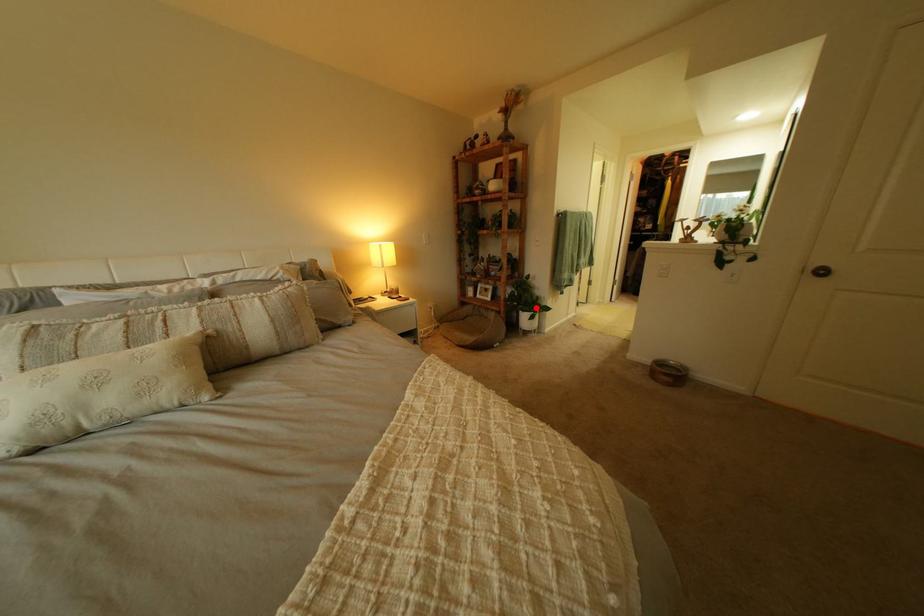
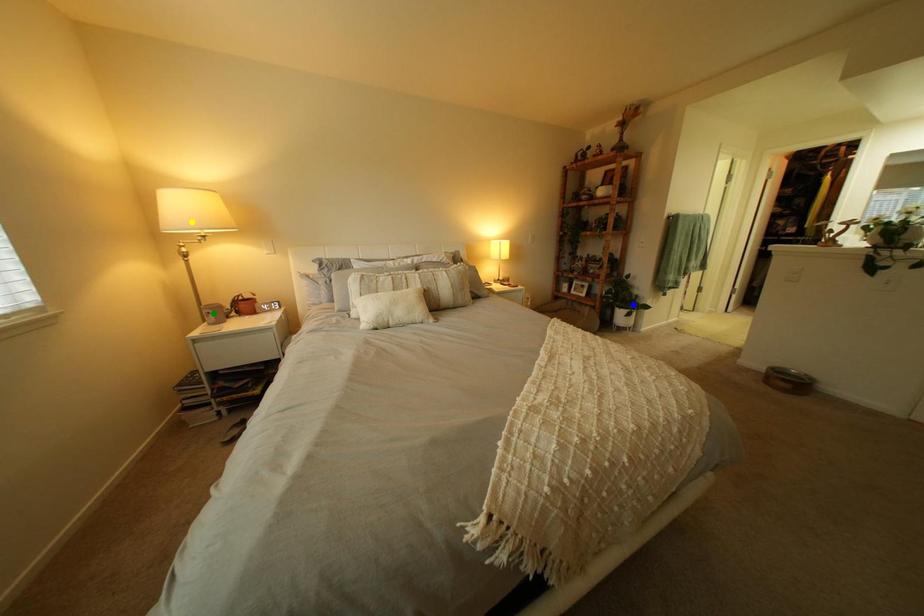
Question: I am providing you with two images of the same scene from different viewpoints. A red point is marked on the first image. You are given multiple points on the second image. Can you choose the point in image 2 that corresponds to the point in image 1?

Choices:
 (A) green point
 (B) blue point
 (C) yellow point

Answer: (B)